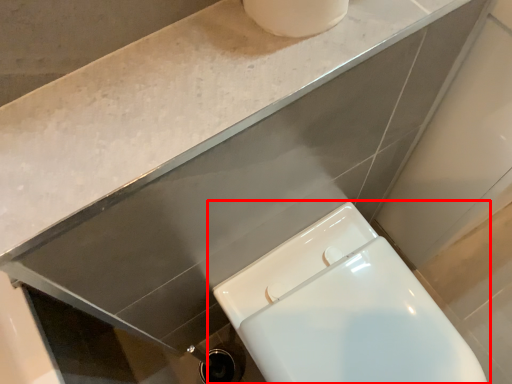
Question: Observing the image, what is the correct spatial positioning of toilet (annotated by the red box) in reference to counter top?

Choices:
 (A) left
 (B) right

Answer: (B)